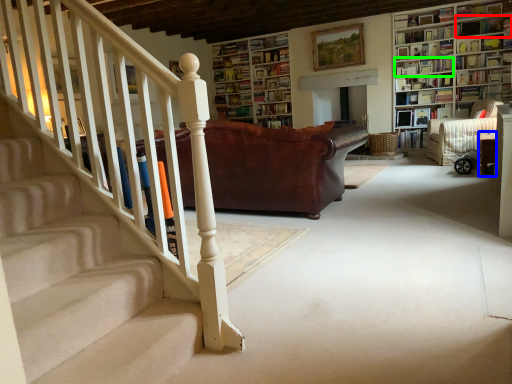
Question: Based on their relative distances, which object is farther from book (highlighted by a red box)? Choose from furniture (highlighted by a blue box) and book (highlighted by a green box).

Choices:
 (A) furniture
 (B) book

Answer: (A)